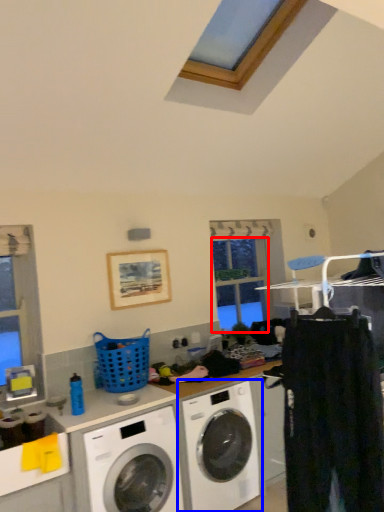
Question: Which object appears farthest to the camera in this image, window screen (highlighted by a red box) or washing machine (highlighted by a blue box)?

Choices:
 (A) window screen
 (B) washing machine

Answer: (A)